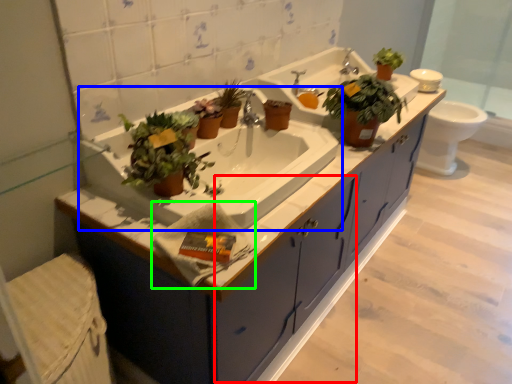
Question: Which is farther away from drawer (highlighted by a red box)? sink (highlighted by a blue box) or hand towel (highlighted by a green box)?

Choices:
 (A) sink
 (B) hand towel

Answer: (B)